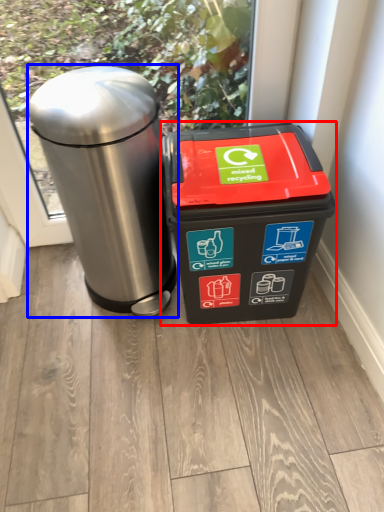
Question: Which of the following is the closest to the observer, waste container (highlighted by a red box) or waste container (highlighted by a blue box)?

Choices:
 (A) waste container
 (B) waste container

Answer: (B)